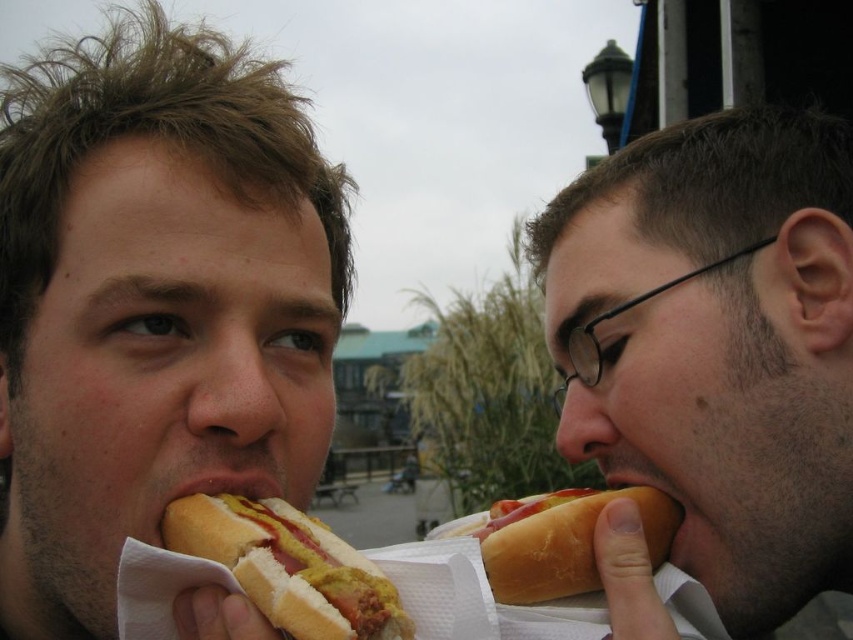
Based on the scene description, which object is taller between the yellow mustard bun at mouth left and the smooth skin mouth at lower right?

The smooth skin mouth at lower right is taller than the yellow mustard bun at mouth left.

You are a food delivery drone with a 50 cm wide carrying compartment. You need to deliver both the white bread hot dog at right and the yellow mustard bun at mouth left to a customer. Can the two items fit side by side in your compartment?

The distance between the white bread hot dog at right and the yellow mustard bun at mouth left is 48.19 centimeters. Since the drone compartment is 50 cm wide, the items can fit side by side as the total width required is less than the compartment width.

You are a food vendor at an outdoor market. You have a customer who wants to know if their hot dog will fit in their mouth without biting it. The customer is looking at the white bread hot dog at right and the smooth skin mouth at lower right. Can you tell them if the hot dog will fit?

The white bread hot dog at right is larger in size compared to the smooth skin mouth at lower right. Therefore, the hot dog may not fit comfortably in the mouth without biting it.